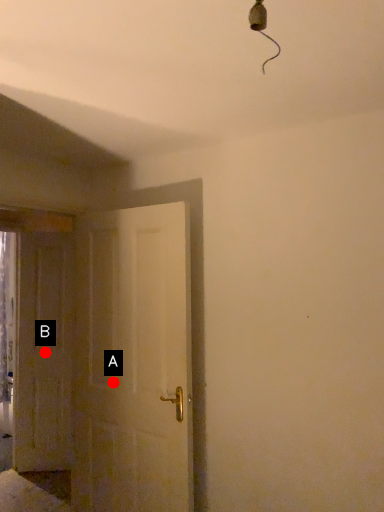
Question: Two points are circled on the image, labeled by A and B beside each circle. Which point is closer to the camera taking this photo?

Choices:
 (A) A is closer
 (B) B is closer

Answer: (A)